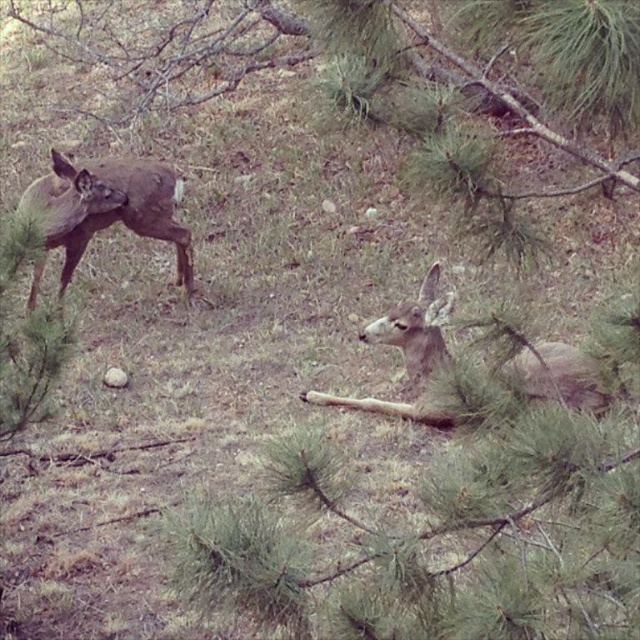
Question: Can you confirm if fawn fur at lower right is wider than brown matte deer at left?

Choices:
 (A) no
 (B) yes

Answer: (A)

Question: Among these points, which one is farthest from the camera?

Choices:
 (A) (392, 333)
 (B) (86, 225)

Answer: (B)

Question: Among these objects, which one is nearest to the camera?

Choices:
 (A) fawn fur at lower right
 (B) brown matte deer at left

Answer: (A)

Question: From the image, what is the correct spatial relationship of fawn fur at lower right in relation to brown matte deer at left?

Choices:
 (A) below
 (B) above

Answer: (A)

Question: Is fawn fur at lower right smaller than brown matte deer at left?

Choices:
 (A) yes
 (B) no

Answer: (A)